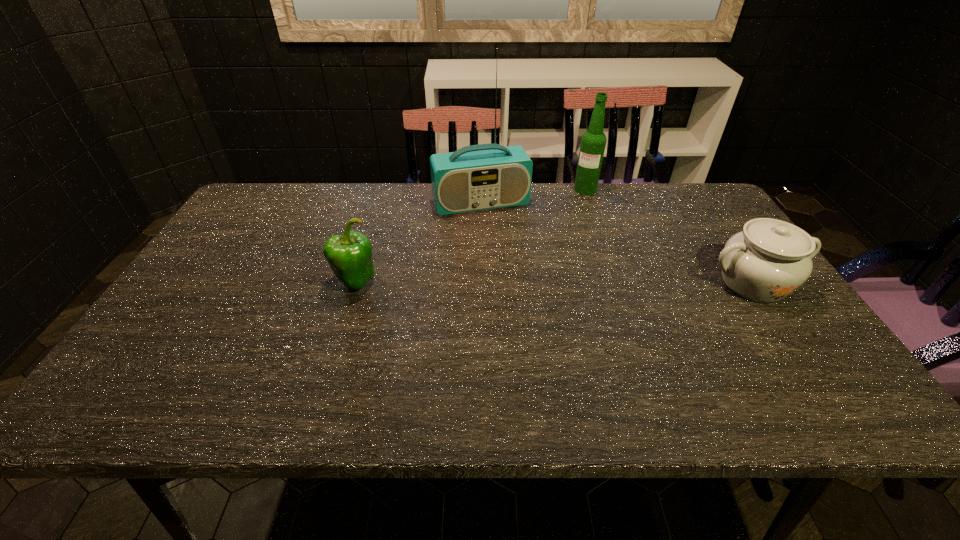
Where is `vacant space that's between the rightmost object and the second object from right to left`? vacant space that's between the rightmost object and the second object from right to left is located at coordinates (669, 237).

Locate an element on the screen. vacant area between the second object from left to right and the second tallest object is located at coordinates (533, 197).

At what (x,y) coordinates should I click in order to perform the action: click on free space between the chinaware and the radio receiver. Please return your answer as a coordinate pair (x, y). The width and height of the screenshot is (960, 540). Looking at the image, I should click on (617, 243).

You are a GUI agent. You are given a task and a screenshot of the screen. Output one action in this format:
    pyautogui.click(x=<x>, y=<y>)
    Task: Click on the object that can be found as the second closest to the rightmost object
    
    Given the screenshot: What is the action you would take?
    pyautogui.click(x=478, y=177)

Locate which object ranks second in proximity to the beer bottle. Please provide its 2D coordinates. Your answer should be formatted as a tuple, i.e. [(x, y)], where the tuple contains the x and y coordinates of a point satisfying the conditions above.

[(770, 259)]

At what (x,y) coordinates should I click in order to perform the action: click on free space that satisfies the following two spatial constraints: 1. on the back side of the beer bottle; 2. on the right side of the third object from right to left. Please return your answer as a coordinate pair (x, y). Image resolution: width=960 pixels, height=540 pixels. Looking at the image, I should click on (481, 190).

Identify the location of blank space that satisfies the following two spatial constraints: 1. on the front side of the rightmost object; 2. on the left side of the radio receiver. (481, 283).

Identify the location of vacant area in the image that satisfies the following two spatial constraints: 1. on the back side of the radio receiver; 2. on the left side of the leftmost object. The width and height of the screenshot is (960, 540). (380, 203).